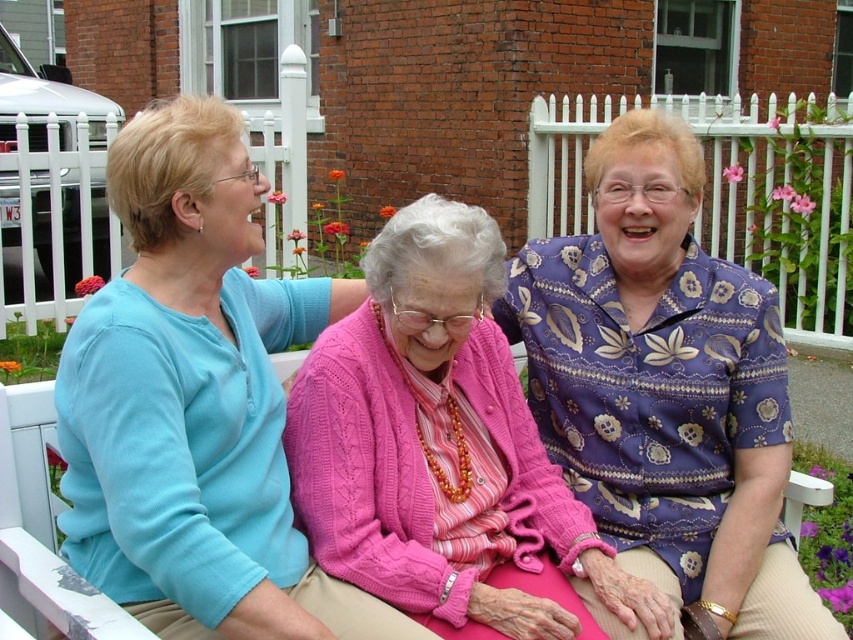
You are taking a photo of the three women on the white bench. You want to focus on the point that is closer to the camera. Which point should you choose between point (277,532) and point (509,292)?

Point (277,532) is closer to the camera than point (509,292), so you should choose point (277,532) to focus on.

You are a photographer taking a picture of the group. You want to focus on the person wearing the pink knitted sweater at center and the purple floral shirt at right. Which one will appear larger in the photo?

The pink knitted sweater at center will appear larger in the photo because it is closer to the viewer than the purple floral shirt at right.

You are a photographer taking a picture of the group. The pink knitted sweater at center and the purple floral shirt at right are both in the frame. Which one is higher in the photo?

The pink knitted sweater at center is higher in the photo because it is above the purple floral shirt at right.